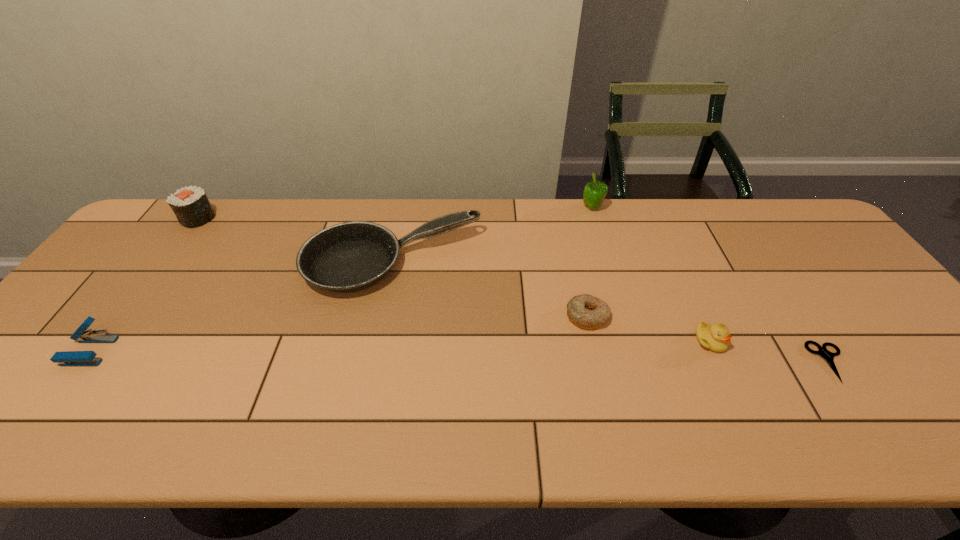
Where is `vacant region between the shortest object and the frying pan`? vacant region between the shortest object and the frying pan is located at coordinates (611, 313).

The width and height of the screenshot is (960, 540). I want to click on free space that is in between the rightmost object and the frying pan, so click(611, 313).

Locate an element on the screen. Image resolution: width=960 pixels, height=540 pixels. free spot between the sixth shortest object and the frying pan is located at coordinates (295, 241).

At what (x,y) coordinates should I click in order to perform the action: click on free area in between the sushi and the stapler. Please return your answer as a coordinate pair (x, y). The image size is (960, 540). Looking at the image, I should click on (144, 285).

Where is `free space between the stapler and the second shortest object`? This screenshot has width=960, height=540. free space between the stapler and the second shortest object is located at coordinates click(x=338, y=334).

Locate an element on the screen. The image size is (960, 540). vacant point located between the sushi and the frying pan is located at coordinates (295, 241).

Where is `unoccupied position between the sixth shortest object and the third object from left to right`? This screenshot has width=960, height=540. unoccupied position between the sixth shortest object and the third object from left to right is located at coordinates (295, 241).

At what (x,y) coordinates should I click in order to perform the action: click on vacant space that's between the fifth object from right to left and the tallest object. Please return your answer as a coordinate pair (x, y). Looking at the image, I should click on (492, 236).

You are a GUI agent. You are given a task and a screenshot of the screen. Output one action in this format:
    pyautogui.click(x=<x>, y=<y>)
    Task: Click on the object that is the fourth closest to the third object from left to right
    This screenshot has width=960, height=540.
    Given the screenshot: What is the action you would take?
    pyautogui.click(x=67, y=358)

Select which object appears as the sixth closest to the stapler. Please provide its 2D coordinates. Your answer should be formatted as a tuple, i.e. [(x, y)], where the tuple contains the x and y coordinates of a point satisfying the conditions above.

[(827, 355)]